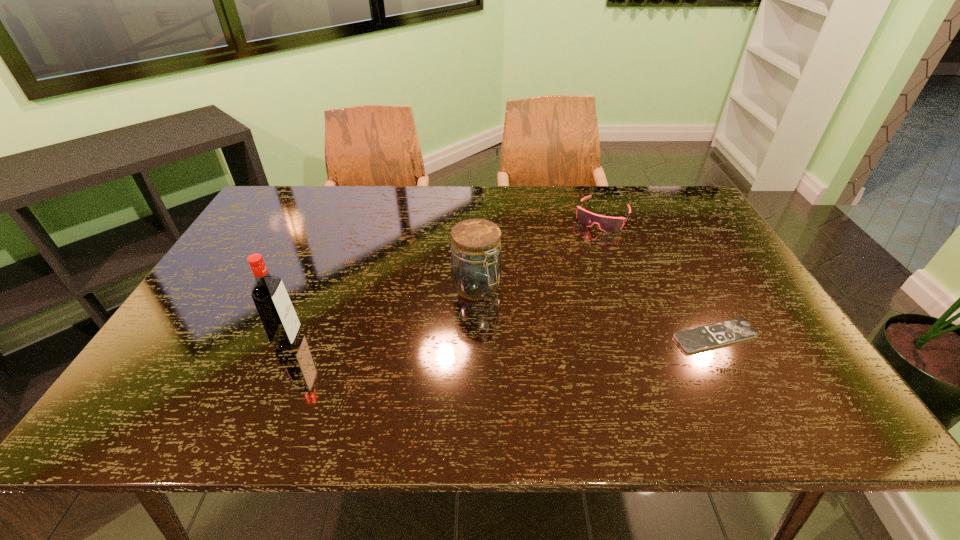
In the image, there is a desktop. Where is `vacant space at the far edge`? The image size is (960, 540). vacant space at the far edge is located at coordinates (364, 217).

Identify the location of vacant area at the near edge. (683, 357).

Locate an element on the screen. free spot at the left edge of the desktop is located at coordinates (286, 247).

At what (x,y) coordinates should I click in order to perform the action: click on vacant space at the right edge. Please return your answer as a coordinate pair (x, y). This screenshot has height=540, width=960. Looking at the image, I should click on (660, 226).

Where is `vacant space at the far right corner`? Image resolution: width=960 pixels, height=540 pixels. vacant space at the far right corner is located at coordinates (656, 198).

In the image, there is a desktop. Identify the location of free space at the near right corner. (794, 360).

Identify the location of vacant area that lies between the leftmost object and the second farthest object. (382, 313).

At what (x,y) coordinates should I click in order to perform the action: click on vacant area that lies between the leftmost object and the shortest object. Please return your answer as a coordinate pair (x, y). Image resolution: width=960 pixels, height=540 pixels. Looking at the image, I should click on (501, 338).

Identify the location of free spot between the remote control and the second farthest object. This screenshot has height=540, width=960. (595, 312).

Find the location of a particular element. The height and width of the screenshot is (540, 960). free spot between the leftmost object and the third object from right to left is located at coordinates (382, 313).